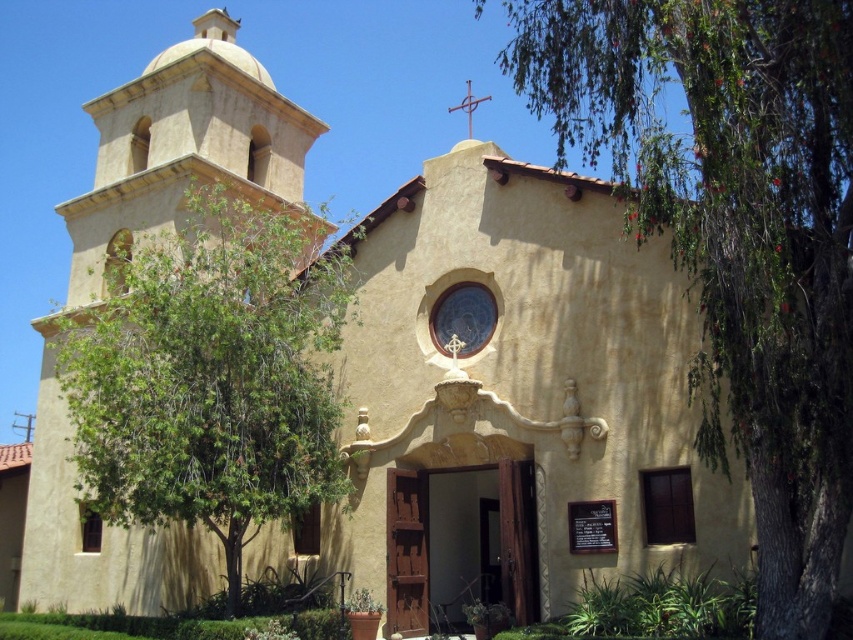
You are standing in front of the historic building and want to take a photo that includes both green leafy tree at right and green leafy tree at left. Which tree should you move towards to get both in the frame without zooming in?

You should move towards the green leafy tree at left because it is farther away, bringing it closer to the green leafy tree at right which is nearer, thereby keeping both in the frame.

You are standing in front of the historic building and want to take a photo of the entrance. To avoid including the green leafy tree at right in your photo, which direction should you move? Please answer with either left, right, forward, or backward.

To avoid including the green leafy tree at right in your photo, you should move to the left. The green leafy tree at right is positioned to the right side of the entrance, so moving left would shift your perspective away from it.